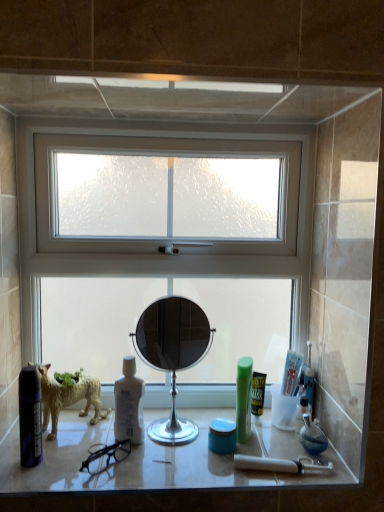
At what (x,y) coordinates should I click in order to perform the action: click on spots to the right of speckled ceramic figurine at lower left. Please return your answer as a coordinate pair (x, y). Looking at the image, I should click on (154, 422).